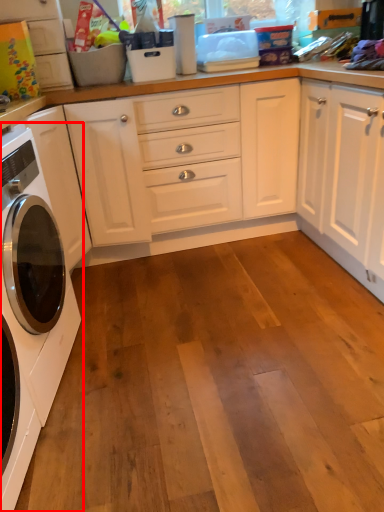
Question: From the image's perspective, where is washing machine (annotated by the red box) located relative to cabinetry?

Choices:
 (A) above
 (B) below

Answer: (B)